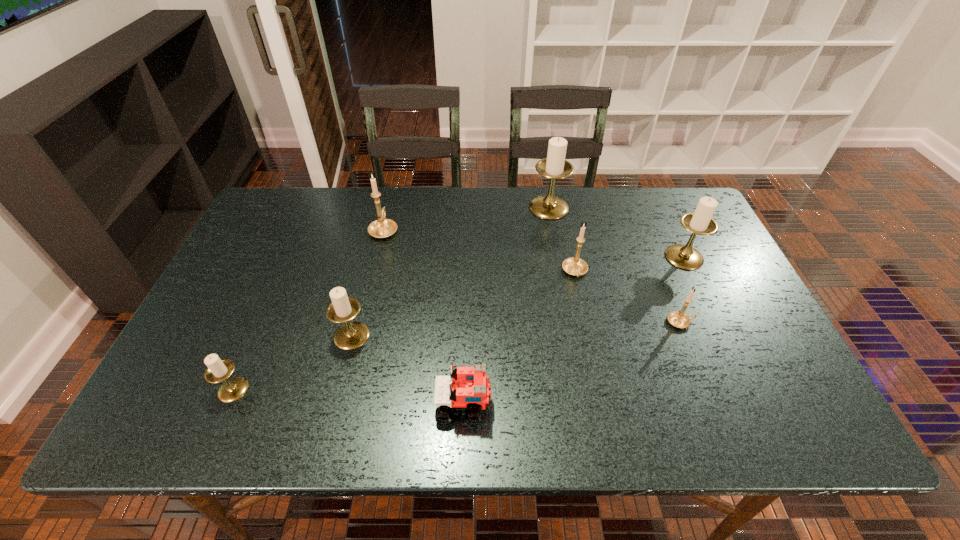
At what (x,y) coordinates should I click in order to perform the action: click on free space located on the back of the rightmost white candle holder. Please return your answer as a coordinate pair (x, y). Image resolution: width=960 pixels, height=540 pixels. Looking at the image, I should click on (660, 204).

Where is `free space located 0.110m on the handle side of the second biggest gold candle holder`? The image size is (960, 540). free space located 0.110m on the handle side of the second biggest gold candle holder is located at coordinates (584, 316).

You are a GUI agent. You are given a task and a screenshot of the screen. Output one action in this format:
    pyautogui.click(x=<x>, y=<y>)
    Task: Click on the vacant area situated on the right of the third farthest white candle holder
    The height and width of the screenshot is (540, 960).
    Given the screenshot: What is the action you would take?
    pyautogui.click(x=419, y=336)

Where is `free space located 0.130m on the handle side of the smallest gold candle holder`? The height and width of the screenshot is (540, 960). free space located 0.130m on the handle side of the smallest gold candle holder is located at coordinates (746, 322).

Identify the location of vacant area situated 0.130m on the back of the nearest candle holder. (259, 330).

Where is `free region located on the front-facing side of the Lego`? free region located on the front-facing side of the Lego is located at coordinates (663, 404).

Where is `candle holder at the near edge`? Image resolution: width=960 pixels, height=540 pixels. candle holder at the near edge is located at coordinates (218, 370).

I want to click on Lego present at the near edge, so click(470, 388).

Find the location of a particular element. This screenshot has width=960, height=540. object that is at the left edge is located at coordinates (218, 370).

Where is `object situated at the right edge`? object situated at the right edge is located at coordinates (700, 222).